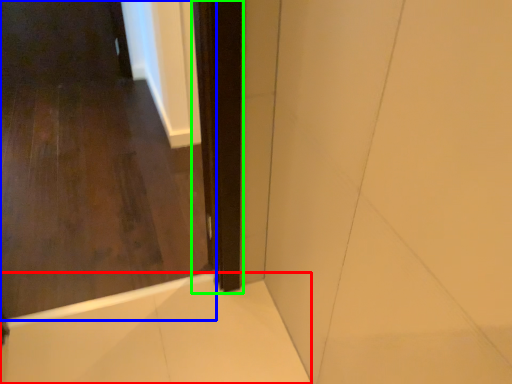
Question: Based on their relative distances, which object is nearer to bath (highlighted by a red box)? Choose from door (highlighted by a blue box) and screen door (highlighted by a green box).

Choices:
 (A) door
 (B) screen door

Answer: (A)